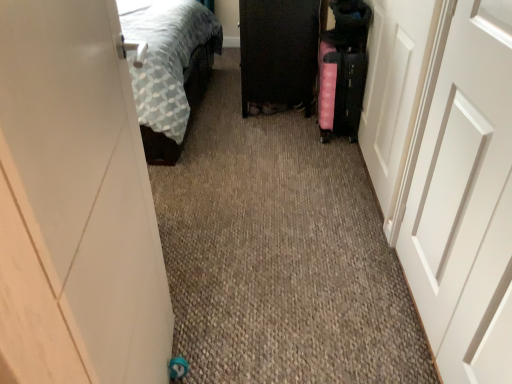
Looking at this image, measure the distance between white glossy door at right, which appears as the 1th door when viewed from the right, and camera.

white glossy door at right, which appears as the 1th door when viewed from the right, and camera are 4.19 feet apart.

Where is `white glossy door at left, which is the first door in left-to-right order`? This screenshot has width=512, height=384. white glossy door at left, which is the first door in left-to-right order is located at coordinates (75, 204).

Identify the location of white matte door at right, placed as the 2th door when sorted from left to right. The width and height of the screenshot is (512, 384). (463, 195).

Where is `pink fabric suitcase at right`? This screenshot has width=512, height=384. pink fabric suitcase at right is located at coordinates (340, 90).

From the image's perspective, relative to black glossy cabinet at center, is pink fabric suitcase at right above or below?

pink fabric suitcase at right is below black glossy cabinet at center.

From the picture: Is pink fabric suitcase at right inside or outside of black glossy cabinet at center?

pink fabric suitcase at right exists outside the volume of black glossy cabinet at center.

Considering their positions, is pink fabric suitcase at right located in front of or behind black glossy cabinet at center?

pink fabric suitcase at right is positioned closer to the viewer than black glossy cabinet at center.

Can you confirm if white matte door at right, arranged as the 2th door when viewed from the right, is taller than pink fabric suitcase at right?

Indeed, white matte door at right, arranged as the 2th door when viewed from the right, has a greater height compared to pink fabric suitcase at right.

Is white matte door at right, placed as the 2th door when sorted from left to right, touching pink fabric suitcase at right?

No, white matte door at right, placed as the 2th door when sorted from left to right, is not making contact with pink fabric suitcase at right.

From a real-world perspective, does white matte door at right, placed as the 2th door when sorted from left to right, stand above pink fabric suitcase at right?

Yes, from a real-world perspective, white matte door at right, placed as the 2th door when sorted from left to right, is over pink fabric suitcase at right

Is white matte door at right, arranged as the 2th door when viewed from the right, not inside pink fabric suitcase at right?

Answer: white matte door at right, arranged as the 2th door when viewed from the right, lies outside pink fabric suitcase at right's area.

Considering the positions of objects white glossy door at right, which is the third door from left to right, and white matte door at right, placed as the 2th door when sorted from left to right, in the image provided, who is in front, white glossy door at right, which is the third door from left to right, or white matte door at right, placed as the 2th door when sorted from left to right,?

white matte door at right, placed as the 2th door when sorted from left to right, is in front.

Measure the distance between white glossy door at right, which appears as the 1th door when viewed from the right, and white matte door at right, arranged as the 2th door when viewed from the right.

The distance of white glossy door at right, which appears as the 1th door when viewed from the right, from white matte door at right, arranged as the 2th door when viewed from the right, is 16.04 inches.

Which point is more distant from viewer, (400, 47) or (507, 60)?

The point (400, 47) is farther.

Is white glossy door at right, which appears as the 1th door when viewed from the right, in contact with white matte door at right, arranged as the 2th door when viewed from the right?

They are not placed beside each other.

Do you think white glossy door at left, acting as the third door starting from the right, is within white matte door at right, placed as the 2th door when sorted from left to right, or outside of it?

white glossy door at left, acting as the third door starting from the right, is located beyond the bounds of white matte door at right, placed as the 2th door when sorted from left to right.

From the image's perspective, is white glossy door at left, acting as the third door starting from the right, under white matte door at right, placed as the 2th door when sorted from left to right?

Correct, white glossy door at left, acting as the third door starting from the right, appears lower than white matte door at right, placed as the 2th door when sorted from left to right, in the image.

Is white glossy door at left, acting as the third door starting from the right, aimed at white matte door at right, placed as the 2th door when sorted from left to right?

Yes, white glossy door at left, acting as the third door starting from the right, is aimed at white matte door at right, placed as the 2th door when sorted from left to right.

How much distance is there between white glossy door at right, which is the third door from left to right, and white glossy door at left, acting as the third door starting from the right?

The distance of white glossy door at right, which is the third door from left to right, from white glossy door at left, acting as the third door starting from the right, is 3.87 feet.

Is white glossy door at left, which is the first door in left-to-right order, at the back of white glossy door at right, which appears as the 1th door when viewed from the right?

That's not correct — white glossy door at right, which appears as the 1th door when viewed from the right, is not looking away from white glossy door at left, which is the first door in left-to-right order.

This screenshot has width=512, height=384. Find the location of `the 2nd door counting from the left side of the white glossy door at right, which appears as the 1th door when viewed from the right`. the 2nd door counting from the left side of the white glossy door at right, which appears as the 1th door when viewed from the right is located at coordinates (75, 204).

From a real-world perspective, is white glossy door at right, which appears as the 1th door when viewed from the right, positioned above or below white glossy door at left, which is the first door in left-to-right order?

Clearly, from a real-world perspective, white glossy door at right, which appears as the 1th door when viewed from the right, is below white glossy door at left, which is the first door in left-to-right order.

Is black glossy cabinet at center next to white matte door at right, arranged as the 2th door when viewed from the right, and touching it?

There is a gap between black glossy cabinet at center and white matte door at right, arranged as the 2th door when viewed from the right.

From a real-world perspective, does black glossy cabinet at center stand above white matte door at right, arranged as the 2th door when viewed from the right?

Actually, black glossy cabinet at center is physically below white matte door at right, arranged as the 2th door when viewed from the right, in the real world.

Is black glossy cabinet at center taller than white matte door at right, arranged as the 2th door when viewed from the right?

Incorrect, the height of black glossy cabinet at center is not larger of that of white matte door at right, arranged as the 2th door when viewed from the right.

Which of these two, black glossy cabinet at center or white matte door at right, arranged as the 2th door when viewed from the right, is thinner?

Thinner between the two is white matte door at right, arranged as the 2th door when viewed from the right.

Where is `luggage that is under the white glossy door at right, which is the third door from left to right (from a real-world perspective)`? luggage that is under the white glossy door at right, which is the third door from left to right (from a real-world perspective) is located at coordinates (340, 90).

Considering the relative positions of white glossy door at right, which appears as the 1th door when viewed from the right, and pink fabric suitcase at right in the image provided, is white glossy door at right, which appears as the 1th door when viewed from the right, in front of pink fabric suitcase at right?

Yes, it is in front of pink fabric suitcase at right.

Is white glossy door at right, which appears as the 1th door when viewed from the right, shorter than pink fabric suitcase at right?

No.

From the image's perspective, is white glossy door at right, which is the third door from left to right, on pink fabric suitcase at right?

No, from the image's perspective, white glossy door at right, which is the third door from left to right, is not above pink fabric suitcase at right.

At what (x,y) coordinates should I click in order to perform the action: click on luggage in front of the black glossy cabinet at center. Please return your answer as a coordinate pair (x, y). This screenshot has height=384, width=512. Looking at the image, I should click on 340,90.

This screenshot has width=512, height=384. In order to click on the 2nd door positioned above the pink fabric suitcase at right (from a real-world perspective) in this screenshot , I will do `click(463, 195)`.

Which object lies further to the anchor point white matte door at right, arranged as the 2th door when viewed from the right, white glossy door at left, which is the first door in left-to-right order, or white glossy door at right, which is the third door from left to right?

The object further to white matte door at right, arranged as the 2th door when viewed from the right, is white glossy door at left, which is the first door in left-to-right order.

Looking at the image, which one is located closer to white glossy door at right, which is the third door from left to right, white matte door at right, placed as the 2th door when sorted from left to right, or black glossy cabinet at center?

white matte door at right, placed as the 2th door when sorted from left to right, is closer to white glossy door at right, which is the third door from left to right.

When comparing their distances from white glossy door at right, which appears as the 1th door when viewed from the right, does black glossy cabinet at center or pink fabric suitcase at right seem further?

black glossy cabinet at center is positioned further to the anchor white glossy door at right, which appears as the 1th door when viewed from the right.

When comparing their distances from black glossy cabinet at center, does white glossy door at right, which is the third door from left to right, or white matte door at right, arranged as the 2th door when viewed from the right, seem further?

white matte door at right, arranged as the 2th door when viewed from the right.

Estimate the real-world distances between objects in this image. Which object is closer to black glossy cabinet at center, white matte door at right, arranged as the 2th door when viewed from the right, or pink fabric suitcase at right?

The object closer to black glossy cabinet at center is pink fabric suitcase at right.

Estimate the real-world distances between objects in this image. Which object is closer to white glossy door at left, acting as the third door starting from the right, white matte door at right, placed as the 2th door when sorted from left to right, or pink fabric suitcase at right?

white matte door at right, placed as the 2th door when sorted from left to right, is closer to white glossy door at left, acting as the third door starting from the right.

Estimate the real-world distances between objects in this image. Which object is closer to white glossy door at left, acting as the third door starting from the right, white matte door at right, arranged as the 2th door when viewed from the right, or white glossy door at right, which is the third door from left to right?

white matte door at right, arranged as the 2th door when viewed from the right, lies closer to white glossy door at left, acting as the third door starting from the right, than the other object.

From the image, which object appears to be farther from pink fabric suitcase at right, white glossy door at right, which is the third door from left to right, or white matte door at right, placed as the 2th door when sorted from left to right?

white matte door at right, placed as the 2th door when sorted from left to right, lies further to pink fabric suitcase at right than the other object.

You are a GUI agent. You are given a task and a screenshot of the screen. Output one action in this format:
    pyautogui.click(x=<x>, y=<y>)
    Task: Click on the luggage between white glossy door at right, which is the third door from left to right, and black glossy cabinet at center from front to back
    
    Given the screenshot: What is the action you would take?
    click(340, 90)

The height and width of the screenshot is (384, 512). What are the coordinates of `luggage positioned between white matte door at right, arranged as the 2th door when viewed from the right, and black glossy cabinet at center from near to far` in the screenshot? It's located at (340, 90).

The width and height of the screenshot is (512, 384). What are the coordinates of `door between white matte door at right, arranged as the 2th door when viewed from the right, and black glossy cabinet at center, along the z-axis` in the screenshot? It's located at (395, 92).

Where is `door between white glossy door at left, acting as the third door starting from the right, and white glossy door at right, which appears as the 1th door when viewed from the right, from front to back`? This screenshot has width=512, height=384. door between white glossy door at left, acting as the third door starting from the right, and white glossy door at right, which appears as the 1th door when viewed from the right, from front to back is located at coordinates (463, 195).